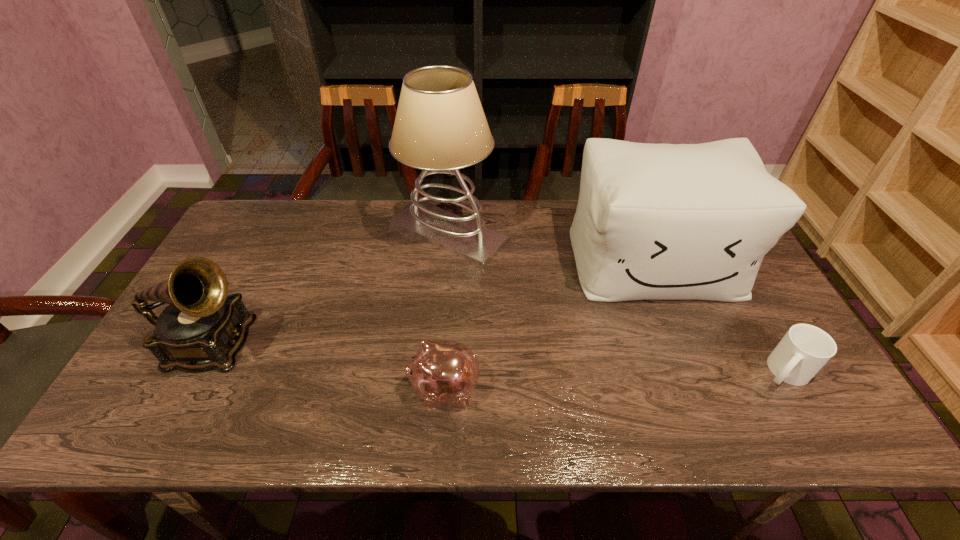
Where is `free spot at the near edge of the desktop`? This screenshot has width=960, height=540. free spot at the near edge of the desktop is located at coordinates (632, 406).

Identify the location of vacant space at the right edge of the desktop. The height and width of the screenshot is (540, 960). (756, 302).

Find the location of a particular element. The image size is (960, 540). free point at the near left corner is located at coordinates (193, 401).

Where is `vacant point located between the table lamp and the fourth tallest object`? Image resolution: width=960 pixels, height=540 pixels. vacant point located between the table lamp and the fourth tallest object is located at coordinates pyautogui.click(x=446, y=310).

Locate an element on the screen. The width and height of the screenshot is (960, 540). free space between the phonograph record and the piggy bank is located at coordinates (328, 367).

At what (x,y) coordinates should I click in order to perform the action: click on vacant space that's between the leftmost object and the mug. Please return your answer as a coordinate pair (x, y). Looking at the image, I should click on (498, 358).

What are the coordinates of `blank region between the fourth tallest object and the mug` in the screenshot? It's located at point(614,380).

Image resolution: width=960 pixels, height=540 pixels. In order to click on blank region between the leftmost object and the piggy bank in this screenshot , I will do `click(328, 367)`.

The width and height of the screenshot is (960, 540). Identify the location of free space between the tallest object and the fourth tallest object. (446, 310).

The width and height of the screenshot is (960, 540). I want to click on free point between the second shortest object and the mug, so click(614, 380).